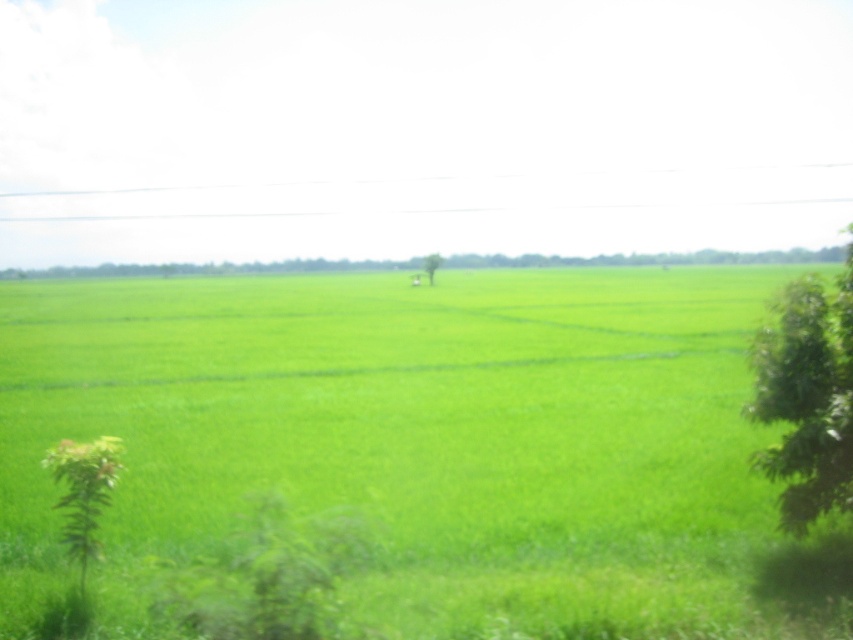
You are a farmer planning to plant new crops. You notice the green grass at center and the green leafy tree at right in the field. Which area would you prioritize for planting if you want to use the space more efficiently?

The green grass at center is bigger than the green leafy tree at right, so you should prioritize planting in the area of the green grass at center to utilize the larger space more efficiently.

You are a farmer checking the field. You see the green grass at center and the green leafy tree at center. Which one has a larger width?

The green grass at center might be wider than green leafy tree at center, so the green grass at center has a larger width.